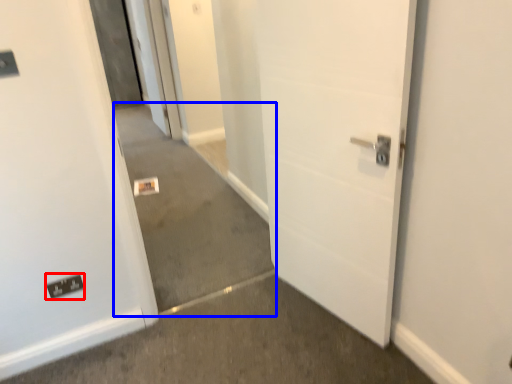
Question: Which point is closer to the camera, electric outlet (highlighted by a red box) or concrete (highlighted by a blue box)?

Choices:
 (A) electric outlet
 (B) concrete

Answer: (B)